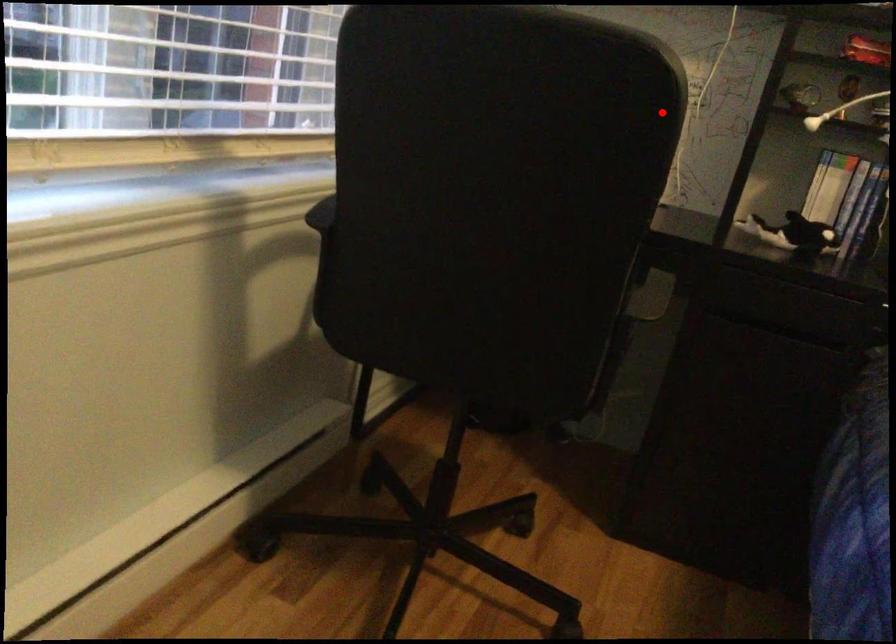
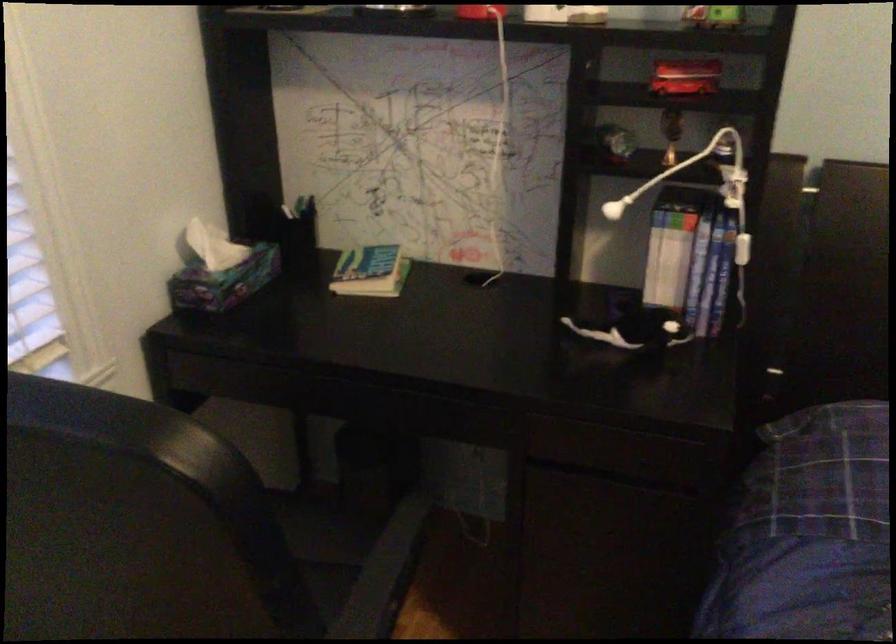
Question: I am providing you with two images of the same scene from different viewpoints. Given a red point in image1, look at the same physical point in image2. Is it:

Choices:
 (A) Closer to the viewpoint
 (B) Farther from the viewpoint

Answer: (A)